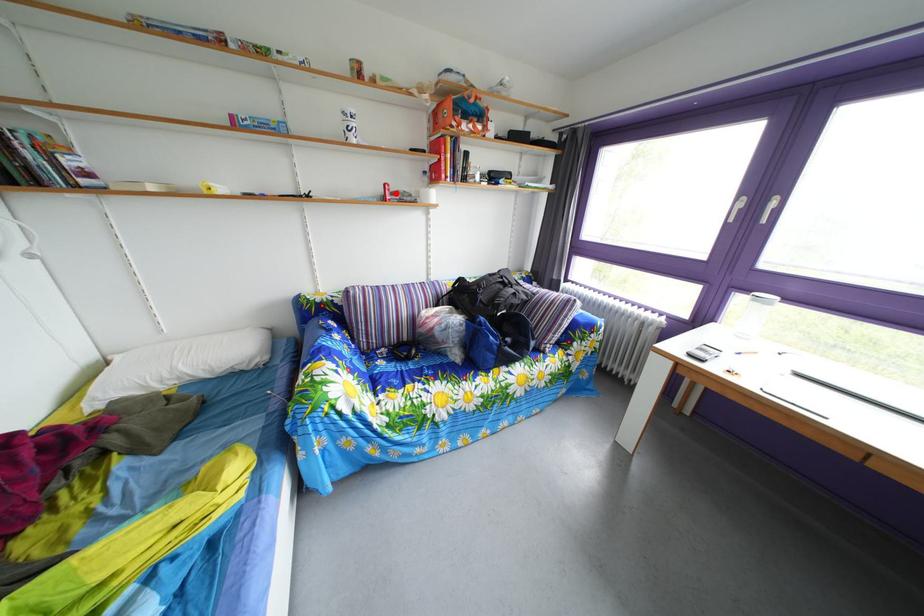
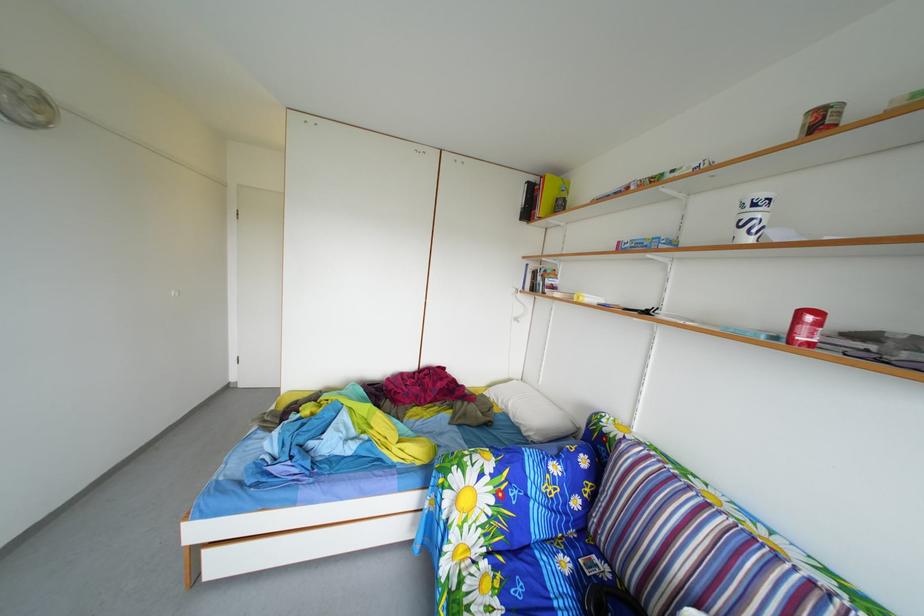
Where in the second image is the point corresponding to the highlighted location from the first image?

(811, 321)